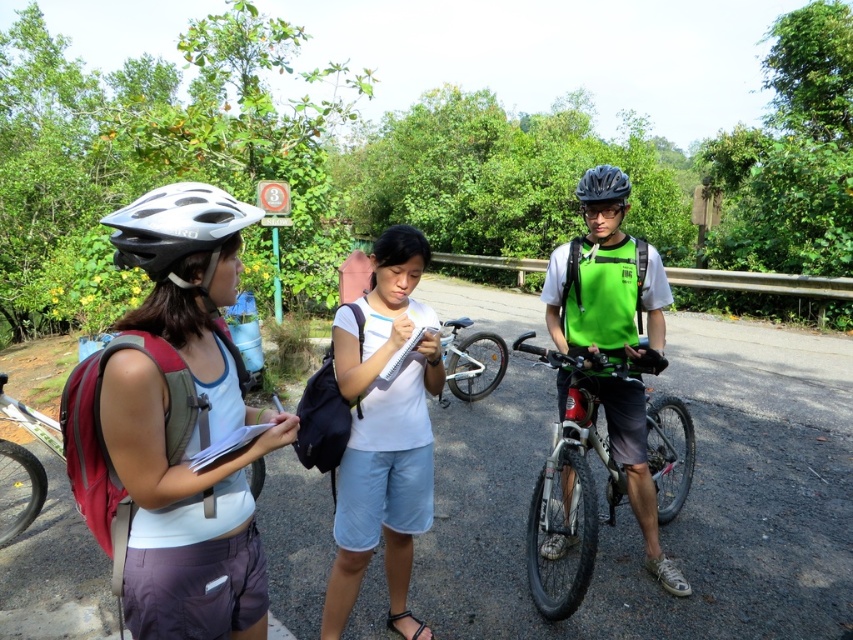
You are a photographer standing at a distance. You want to take a photo of the white matte shirt at center and the silver metallic bicycle at center. Which object will appear narrower in the photo?

The white matte shirt at center will appear narrower in the photo because it has a lesser width compared to the silver metallic bicycle at center.